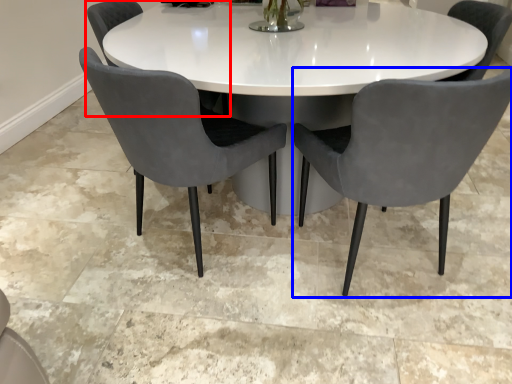
Question: Among these objects, which one is farthest to the camera, chair (highlighted by a red box) or chair (highlighted by a blue box)?

Choices:
 (A) chair
 (B) chair

Answer: (A)